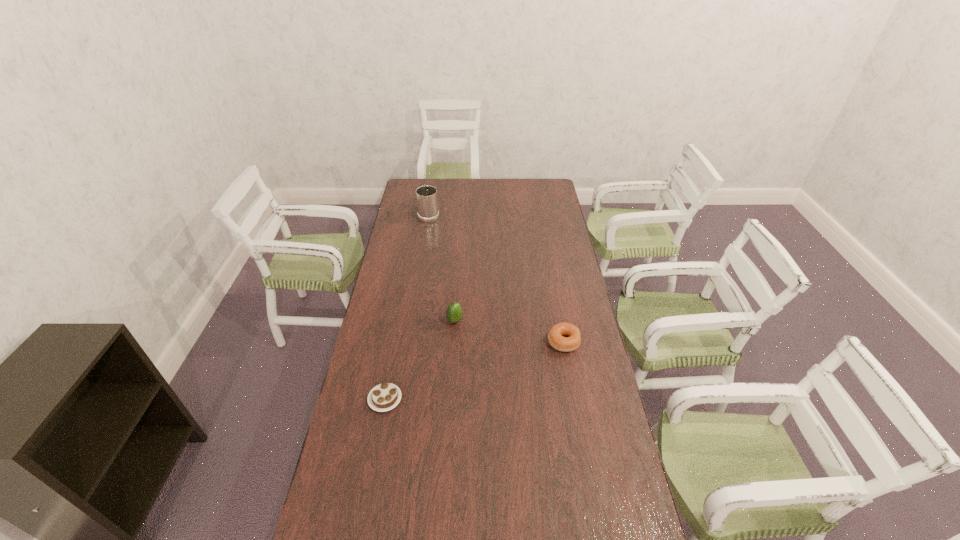
This screenshot has height=540, width=960. In order to click on vacant space at the far right corner of the desktop in this screenshot , I will do `click(540, 200)`.

Where is `vacant space that's between the rightmost object and the nearest object`? vacant space that's between the rightmost object and the nearest object is located at coordinates (474, 370).

You are a GUI agent. You are given a task and a screenshot of the screen. Output one action in this format:
    pyautogui.click(x=<x>, y=<y>)
    Task: Click on the vacant space in between the nearest object and the third nearest object
    This screenshot has width=960, height=540.
    Given the screenshot: What is the action you would take?
    pyautogui.click(x=420, y=360)

At what (x,y) coordinates should I click in order to perform the action: click on blank region between the second farthest object and the tallest object. Please return your answer as a coordinate pair (x, y). The image size is (960, 540). Looking at the image, I should click on click(x=442, y=268).

Find the location of `vacant area that lies between the third nearest object and the mug`. vacant area that lies between the third nearest object and the mug is located at coordinates (442, 268).

This screenshot has height=540, width=960. Find the location of `free space between the third shortest object and the mug`. free space between the third shortest object and the mug is located at coordinates (442, 268).

The height and width of the screenshot is (540, 960). I want to click on vacant area that lies between the mug and the third farthest object, so click(x=496, y=278).

This screenshot has height=540, width=960. I want to click on vacant space that's between the third shortest object and the shortest object, so click(x=420, y=360).

This screenshot has height=540, width=960. Find the location of `free space between the rightmost object and the shortest object`. free space between the rightmost object and the shortest object is located at coordinates (474, 370).

The image size is (960, 540). Find the location of `free spot between the shortest object and the avocado`. free spot between the shortest object and the avocado is located at coordinates (420, 360).